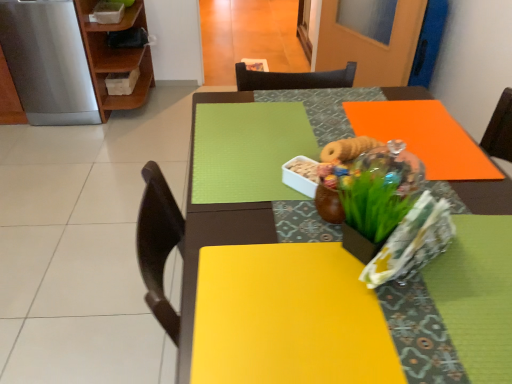
The width and height of the screenshot is (512, 384). In order to click on blank space above orange matte table at upper right (from a real-world perspective) in this screenshot , I will do `click(366, 134)`.